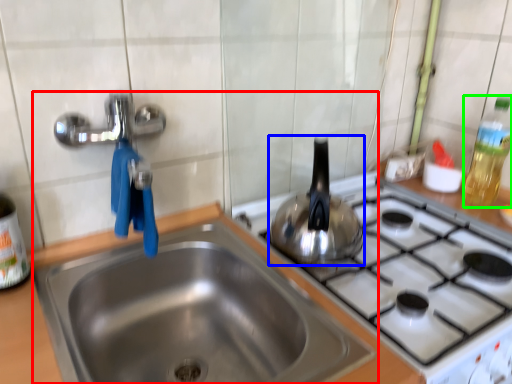
Question: Estimate the real-world distances between objects in this image. Which object is closer to sink (highlighted by a red box), tea pot (highlighted by a blue box) or bottle (highlighted by a green box)?

Choices:
 (A) tea pot
 (B) bottle

Answer: (A)